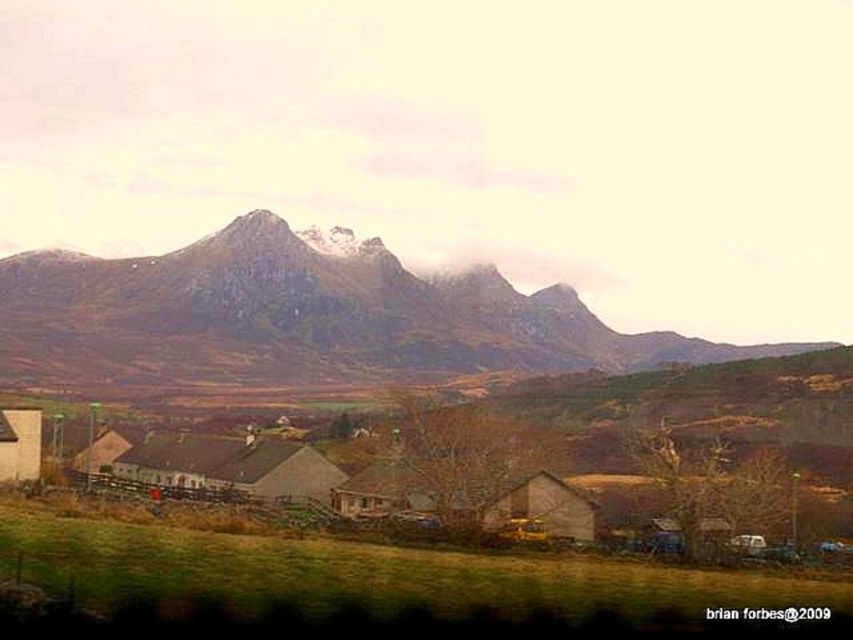
You are standing in the rural landscape scene and want to take a photo of the rocky gray mountain at upper center. Where should you aim your camera to capture it in the frame?

You should aim your camera at the coordinates point (300, 317) to capture the rocky gray mountain at upper center in the frame.

You are standing in the rural landscape and want to take a photo of the matte white hut at lower left and the rocky gray mountain at upper center. Which object should you position to the right side of your camera frame to include both in the shot?

You should position the rocky gray mountain at upper center to the right side of your camera frame since it is already to the right of the matte white hut at lower left, allowing both to be included in the shot.